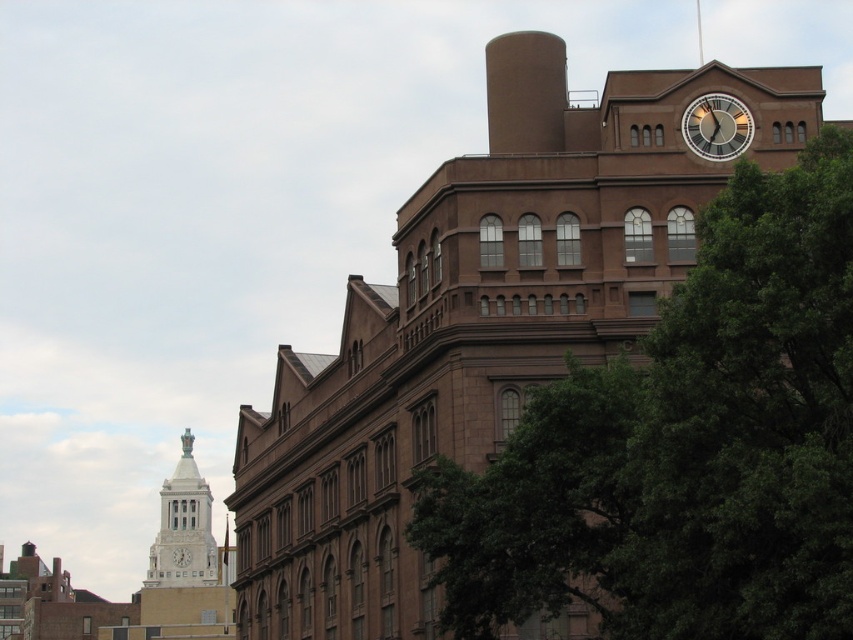
Is brown matte chimney at upper center shorter than white stone clock tower at left?

No.

Is point (495, 68) less distant than point (169, 566)?

Yes, point (495, 68) is in front of point (169, 566).

You are a GUI agent. You are given a task and a screenshot of the screen. Output one action in this format:
    pyautogui.click(x=<x>, y=<y>)
    Task: Click on the brown matte chimney at upper center
    The height and width of the screenshot is (640, 853).
    Given the screenshot: What is the action you would take?
    pyautogui.click(x=525, y=92)

Based on the photo, is brown matte chimney at upper center below white marble clock at upper center?

Incorrect, brown matte chimney at upper center is not positioned below white marble clock at upper center.

Does brown matte chimney at upper center appear on the left side of white marble clock at upper center?

Incorrect, brown matte chimney at upper center is not on the left side of white marble clock at upper center.

Is point (543, 81) positioned in front of point (189, 550)?

Yes, it is in front of point (189, 550).

Locate an element on the screen. The height and width of the screenshot is (640, 853). brown matte chimney at upper center is located at coordinates (525, 92).

Can you confirm if green leafy tree at upper right is taller than brown matte chimney at upper center?

In fact, green leafy tree at upper right may be shorter than brown matte chimney at upper center.

Does green leafy tree at upper right appear over brown matte chimney at upper center?

Incorrect, green leafy tree at upper right is not positioned above brown matte chimney at upper center.

Identify the location of green leafy tree at upper right. This screenshot has height=640, width=853. (683, 445).